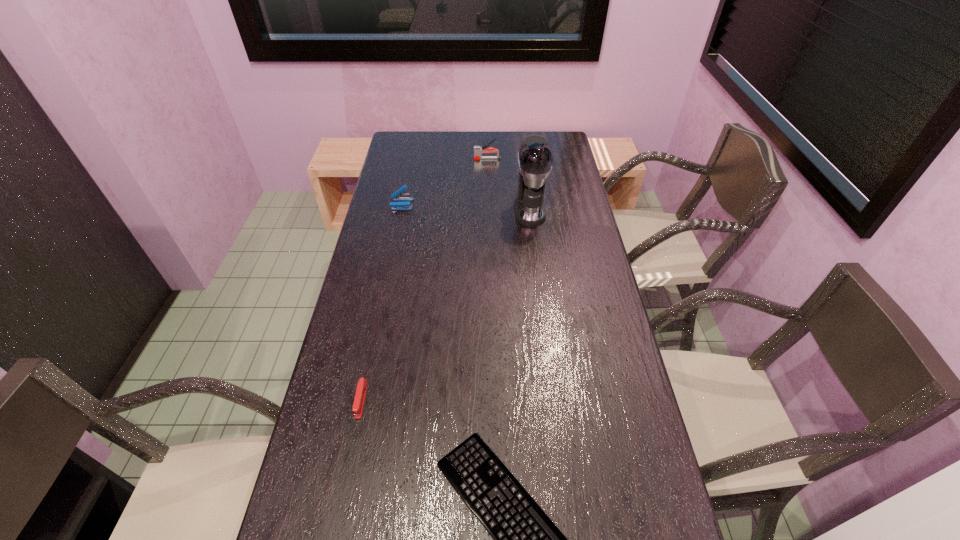
This screenshot has width=960, height=540. I want to click on vacant area situated 0.270m on the handle side of the farthest object, so click(x=411, y=159).

The width and height of the screenshot is (960, 540). I want to click on vacant point located 0.340m on the right of the third shortest object, so click(x=503, y=204).

Locate an element on the screen. The image size is (960, 540). free spot located on the front-facing side of the fourth farthest object is located at coordinates (338, 514).

Where is `object located in the far edge section of the desktop`? Image resolution: width=960 pixels, height=540 pixels. object located in the far edge section of the desktop is located at coordinates (478, 150).

Identify the location of object that is at the right edge. (535, 158).

This screenshot has height=540, width=960. Identify the location of blank space at the far edge of the desktop. (451, 140).

Locate an element on the screen. vacant space at the left edge is located at coordinates (335, 479).

This screenshot has height=540, width=960. In order to click on free region at the right edge in this screenshot , I will do pos(555,293).

The image size is (960, 540). In the image, there is a desktop. What are the coordinates of `vacant space at the far left corner` in the screenshot? It's located at (402, 153).

Locate an element on the screen. blank region between the shortest stapler and the farthest stapler is located at coordinates (424, 279).